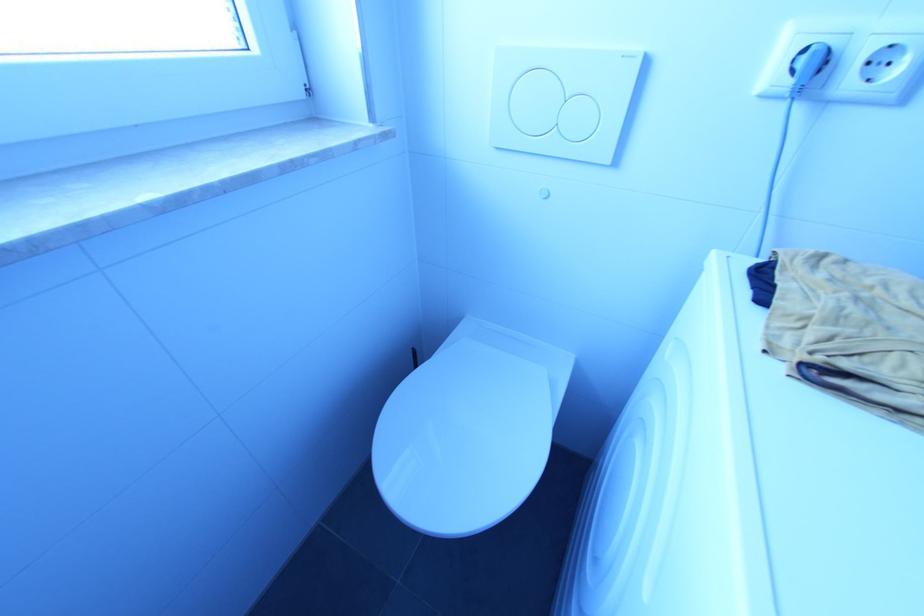
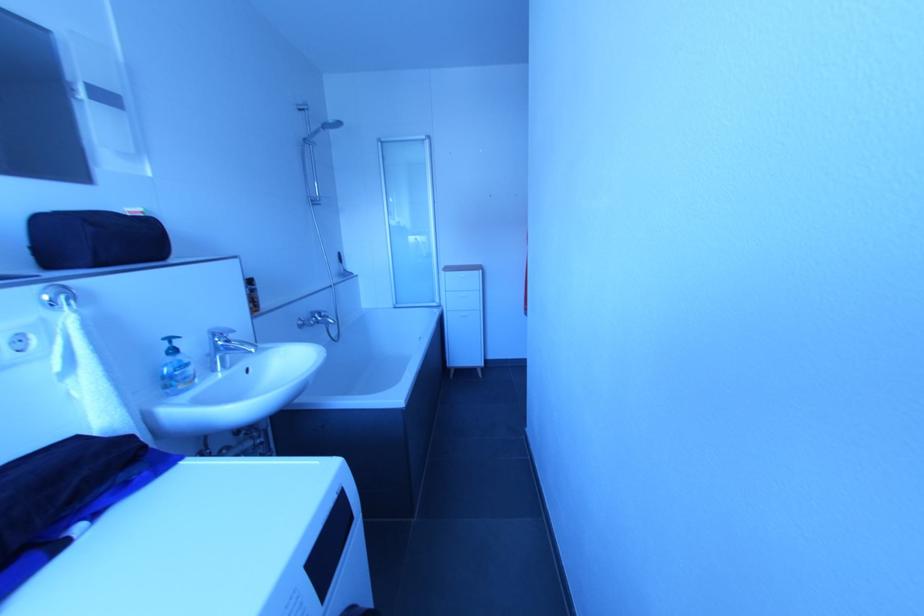
Based on the continuous images, in which direction is the camera rotating?

The camera's rotation is toward right-down.